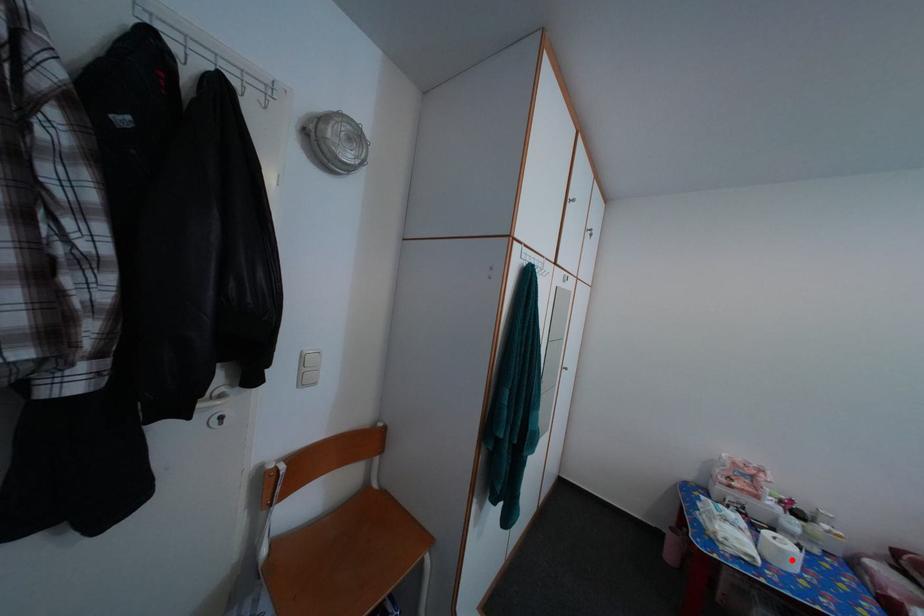
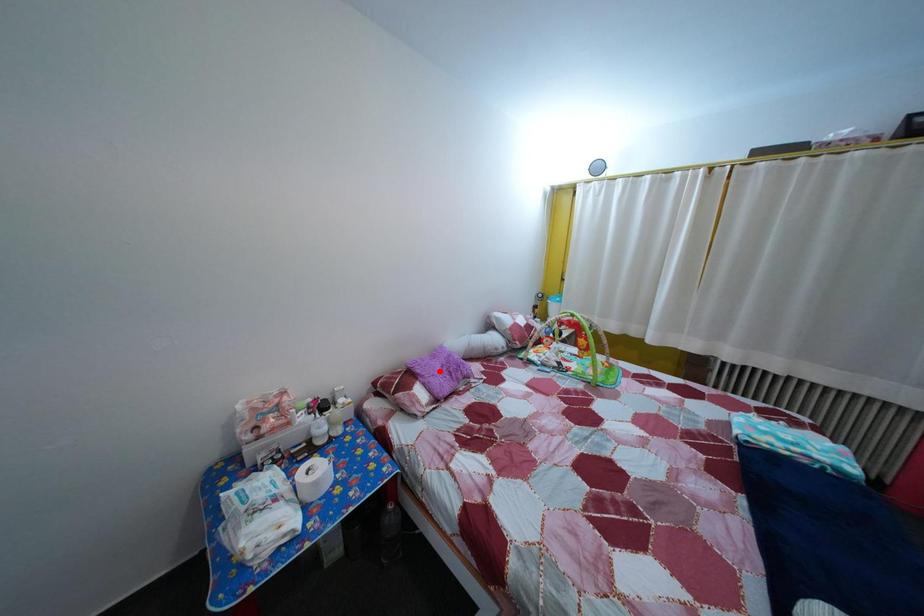
I am providing you with two images of the same scene from different viewpoints. A red point is marked on the first image and another point is marked on the second image. Do the highlighted points in image1 and image2 indicate the same real-world spot?

No